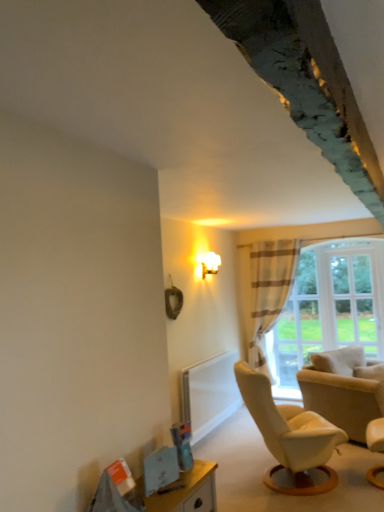
Question: In terms of size, does white sheer curtain at center appear bigger or smaller than clear glass window at right?

Choices:
 (A) big
 (B) small

Answer: (A)

Question: In the image, is white sheer curtain at center positioned in front of or behind clear glass window at right?

Choices:
 (A) front
 (B) behind

Answer: (A)

Question: Which object is the farthest from the matte white sconce at upper right?

Choices:
 (A) white sheer curtain at center
 (B) white leather chair at lower right, acting as the second chair starting from the back
 (C) beige fabric chair at lower right, the 1th chair positioned from the back
 (D) wooden table at lower left
 (E) clear glass window at right

Answer: (D)

Question: Which object is the farthest from the wooden table at lower left?

Choices:
 (A) white sheer curtain at center
 (B) clear glass window at right
 (C) white leather chair at lower right, acting as the second chair starting from the back
 (D) beige fabric chair at lower right, the 1th chair positioned from the back
 (E) matte white sconce at upper right

Answer: (A)